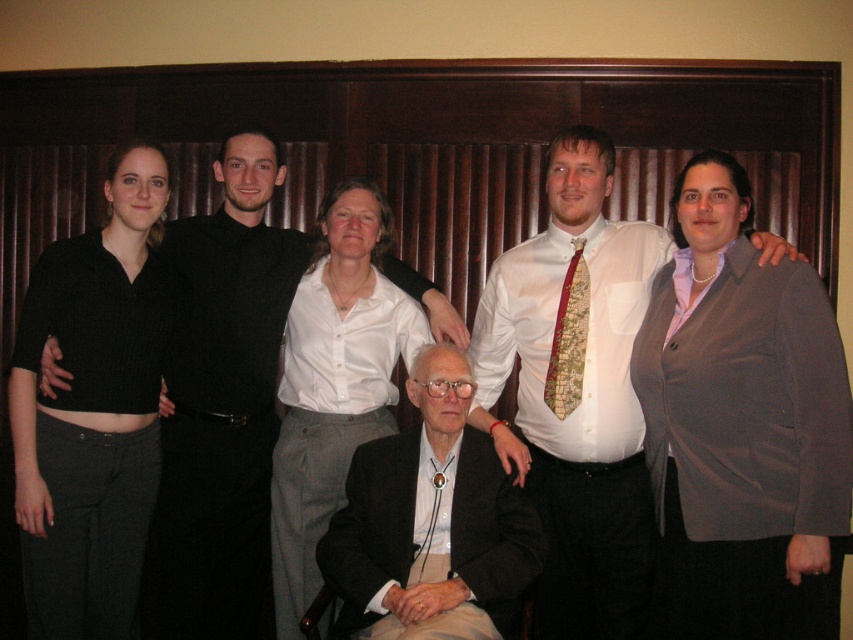
Question: Which point is closer to the camera?

Choices:
 (A) white shirt at center
 (B) black leather suit at center
 (C) black knit top at left

Answer: (B)

Question: Is black knit top at left positioned behind black smooth shirt at left?

Choices:
 (A) no
 (B) yes

Answer: (A)

Question: Which point is closer to the camera?

Choices:
 (A) click(x=39, y=266)
 (B) click(x=605, y=436)

Answer: (B)

Question: Which object is closer to the camera taking this photo?

Choices:
 (A) gray wool blazer at right
 (B) matte white shirt at center
 (C) black knit top at left
 (D) black smooth shirt at left

Answer: (A)

Question: Is matte white shirt at center below black smooth shirt at left?

Choices:
 (A) yes
 (B) no

Answer: (B)

Question: Is black knit top at left to the left of black smooth shirt at left from the viewer's perspective?

Choices:
 (A) no
 (B) yes

Answer: (B)